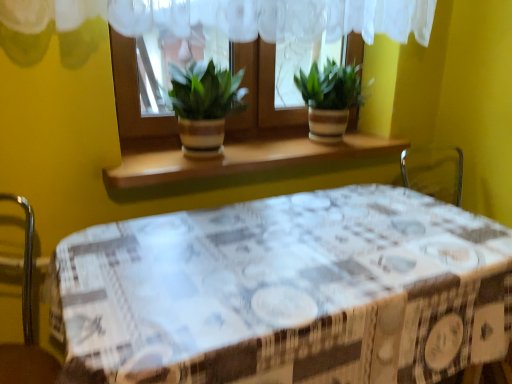
Question: Which direction should I rotate to look at green striped pot at center, which ranks as the 1th houseplant in right-to-left order?

Choices:
 (A) left
 (B) right

Answer: (B)

Question: Does green striped pot at center, which is the second houseplant in left-to-right order, turn towards wooden at center?

Choices:
 (A) yes
 (B) no

Answer: (B)

Question: Is green striped pot at center, which ranks as the 1th houseplant in right-to-left order, to the right of wooden at center from the viewer's perspective?

Choices:
 (A) yes
 (B) no

Answer: (A)

Question: Is green striped pot at center, which is the second houseplant in left-to-right order, surrounding wooden at center?

Choices:
 (A) no
 (B) yes

Answer: (A)

Question: Is the depth of green striped pot at center, which ranks as the 1th houseplant in right-to-left order, greater than that of wooden at center?

Choices:
 (A) no
 (B) yes

Answer: (B)

Question: Are green striped pot at center, which is the second houseplant in left-to-right order, and wooden at center located far from each other?

Choices:
 (A) yes
 (B) no

Answer: (B)

Question: Is green striped pot at center, which is the second houseplant in left-to-right order, at the left side of wooden at center?

Choices:
 (A) yes
 (B) no

Answer: (B)

Question: Is white printed tablecloth at center completely or partially outside of green striped pot at center, which is the second houseplant in left-to-right order?

Choices:
 (A) yes
 (B) no

Answer: (A)

Question: Can you confirm if white printed tablecloth at center is bigger than green striped pot at center, which ranks as the 1th houseplant in right-to-left order?

Choices:
 (A) yes
 (B) no

Answer: (A)

Question: Can you confirm if white printed tablecloth at center is shorter than green striped pot at center, which ranks as the 1th houseplant in right-to-left order?

Choices:
 (A) yes
 (B) no

Answer: (B)

Question: From the image's perspective, does white printed tablecloth at center appear higher than green striped pot at center, which ranks as the 1th houseplant in right-to-left order?

Choices:
 (A) yes
 (B) no

Answer: (B)

Question: Would you consider white printed tablecloth at center to be distant from green striped pot at center, which is the second houseplant in left-to-right order?

Choices:
 (A) yes
 (B) no

Answer: (B)

Question: Does white printed tablecloth at center appear on the left side of green striped pot at center, which ranks as the 1th houseplant in right-to-left order?

Choices:
 (A) no
 (B) yes

Answer: (B)

Question: Is green leafy plant at center aimed at matte brown pot at center, the second houseplant viewed from the right?

Choices:
 (A) yes
 (B) no

Answer: (A)